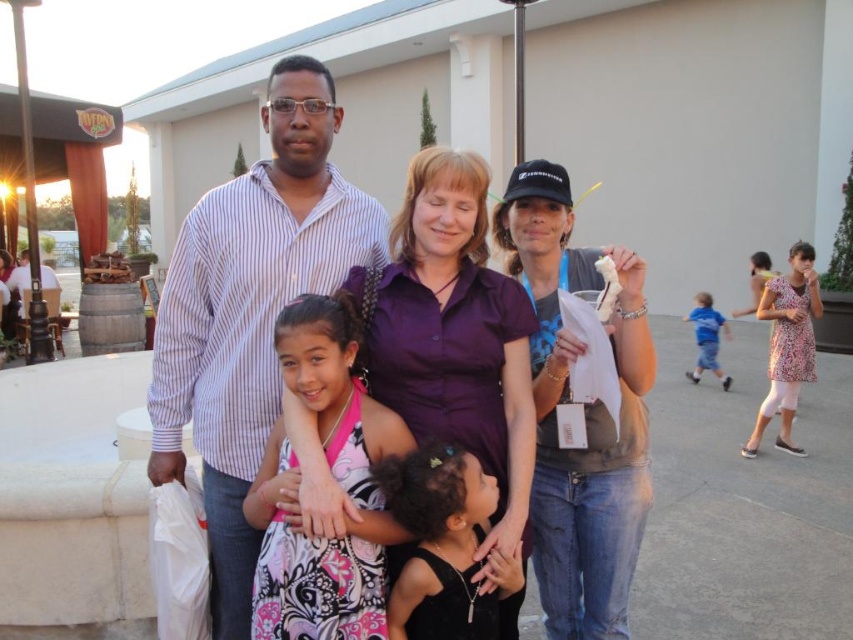
Question: Which point appears closest to the camera in this image?

Choices:
 (A) (705, 298)
 (B) (595, 461)
 (C) (238, 518)
 (D) (451, 458)

Answer: (D)

Question: Which object is positioned farthest from the matte black shirt at center?

Choices:
 (A) purple smooth shirt at center
 (B) black satin dress at center
 (C) striped cotton shirt at center
 (D) pink floral dress at upper right

Answer: (D)

Question: Which of these objects is positioned farthest from the purple smooth shirt at center?

Choices:
 (A) striped cotton shirt at center
 (B) matte black shirt at center
 (C) black satin dress at center
 (D) pink satin dress at center

Answer: (B)

Question: Can you confirm if blue denim shorts at right is smaller than pink floral dress at upper right?

Choices:
 (A) no
 (B) yes

Answer: (A)

Question: Does striped cotton shirt at center appear on the right side of pink floral dress at upper right?

Choices:
 (A) yes
 (B) no

Answer: (B)

Question: Is striped cotton shirt at center smaller than blue denim shorts at right?

Choices:
 (A) no
 (B) yes

Answer: (B)